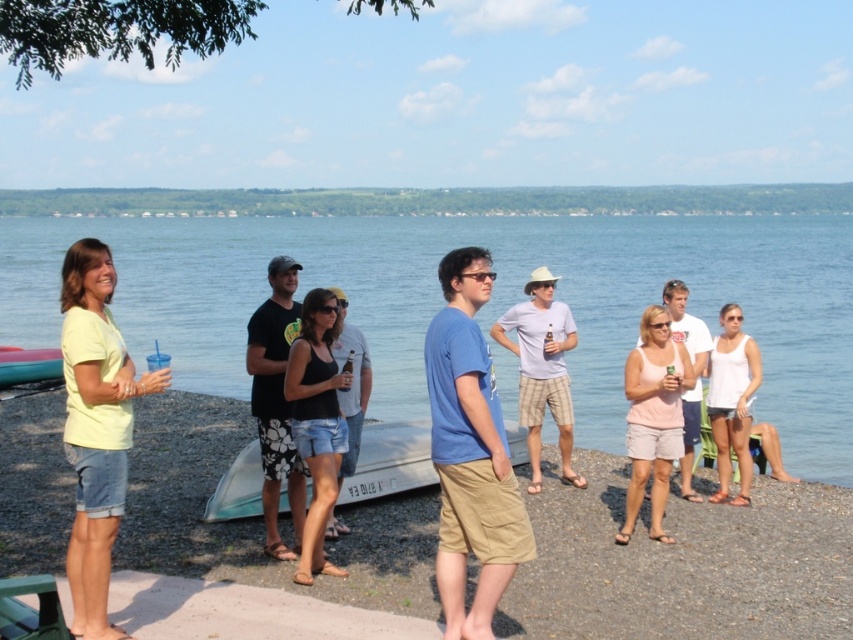
You are a photographer trying to capture a group photo of the yellow matte shirt at center and the pink cotton tank top at center. If you want to ensure both are fully visible in the frame, which person should you position closer to the camera?

The yellow matte shirt at center has a larger width than the pink cotton tank top at center, so you should position the yellow matte shirt at center closer to the camera to ensure both are fully visible in the frame.